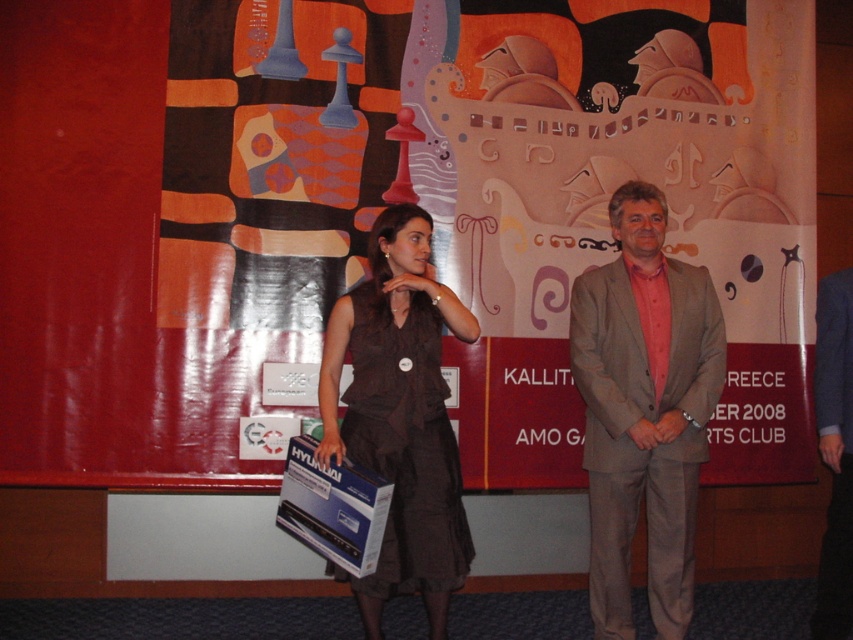
Is light brown suit at center shorter than gray fabric suit at center?

No, light brown suit at center is not shorter than gray fabric suit at center.

Who is more distant from viewer, (705, 369) or (819, 291)?

The point (819, 291) is behind.

Find the location of `light brown suit at center`. light brown suit at center is located at coordinates (643, 410).

Which is in front, point (15, 52) or point (850, 365)?

Point (850, 365) is more forward.

Does matte cardboard poster at center appear under gray fabric suit at center?

No.

The width and height of the screenshot is (853, 640). Find the location of `matte cardboard poster at center`. matte cardboard poster at center is located at coordinates (381, 209).

This screenshot has width=853, height=640. Find the location of `matte cardboard poster at center`. matte cardboard poster at center is located at coordinates (381, 209).

Is the position of matte cardboard poster at center less distant than that of brown fabric dress at center?

That is False.

Can you confirm if matte cardboard poster at center is wider than brown fabric dress at center?

Yes, matte cardboard poster at center is wider than brown fabric dress at center.

Find the location of a particular element. matte cardboard poster at center is located at coordinates pos(381,209).